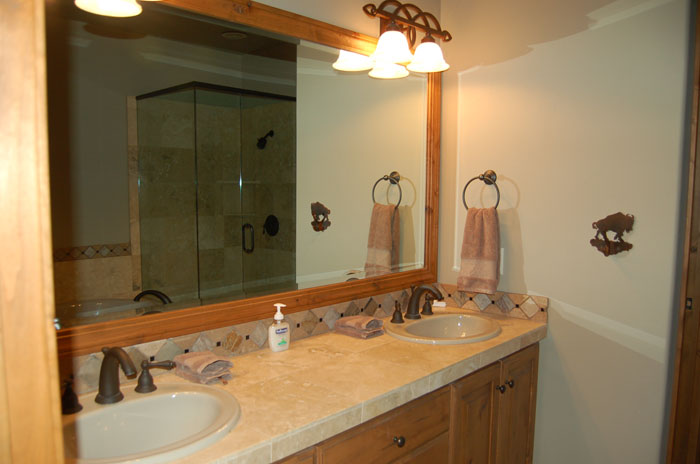
You are a GUI agent. You are given a task and a screenshot of the screen. Output one action in this format:
    pyautogui.click(x=<x>, y=<y>)
    Task: Click on the light fixture
    
    Given the screenshot: What is the action you would take?
    pyautogui.click(x=411, y=50), pyautogui.click(x=117, y=5)